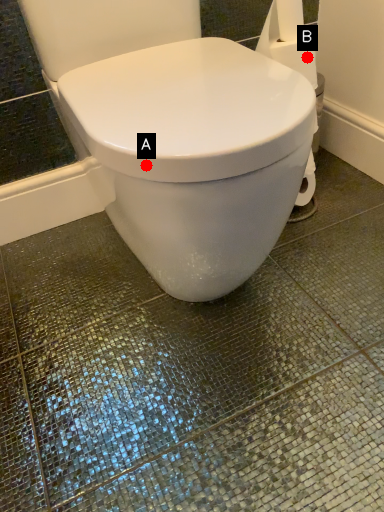
Question: Two points are circled on the image, labeled by A and B beside each circle. Which point is closer to the camera?

Choices:
 (A) A is closer
 (B) B is closer

Answer: (A)